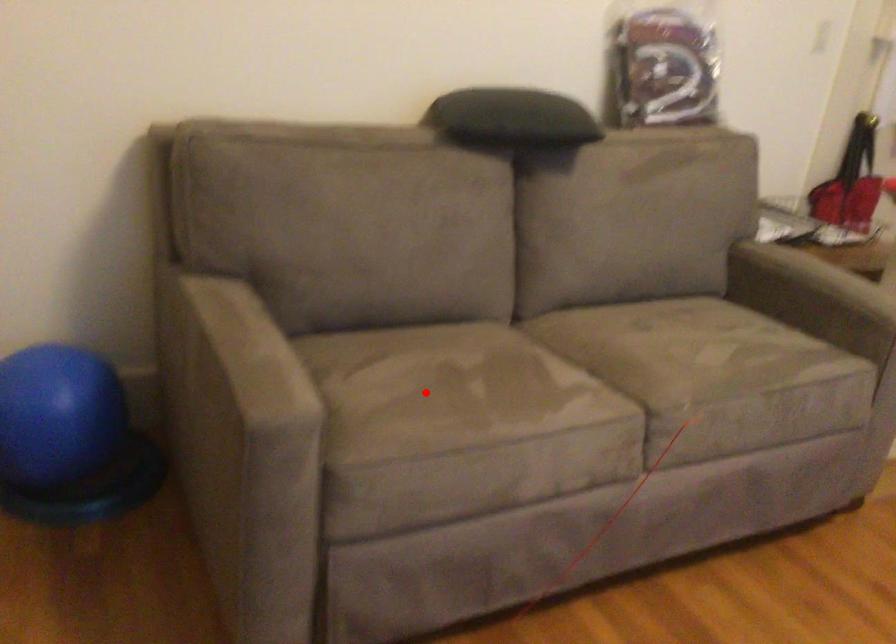
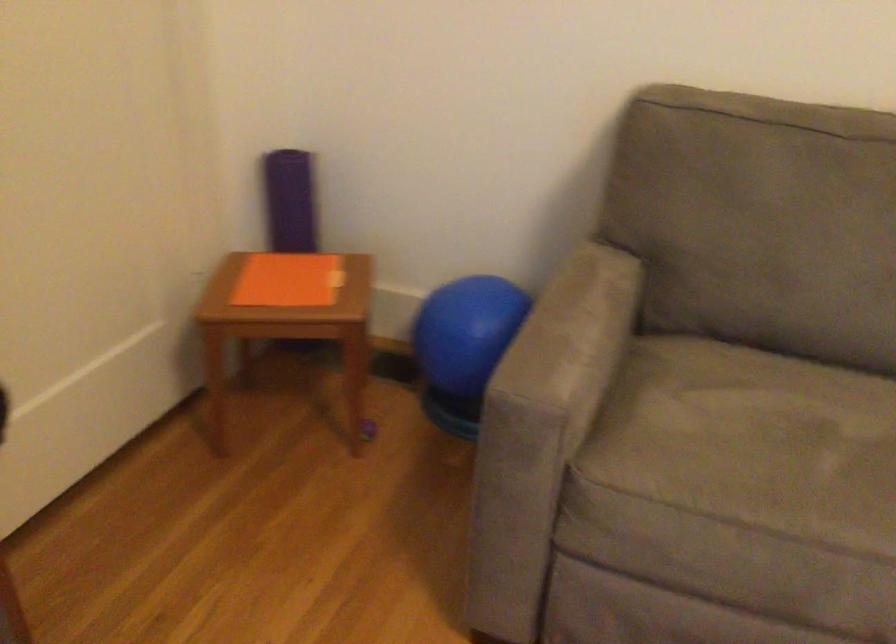
In the second image, find the point that corresponds to the highlighted location in the first image.

(752, 442)